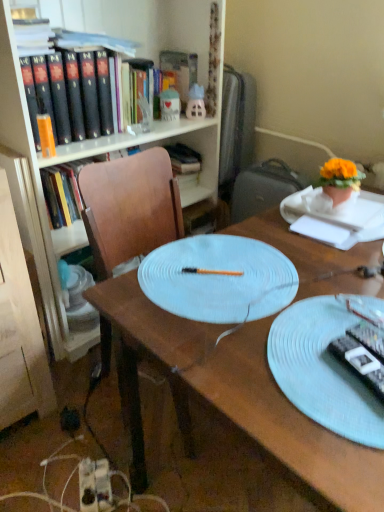
Question: Is matte wood bookcase at upper left oriented away from matte pink plastic toy at upper center, which is counted as the first toy, starting from the right?

Choices:
 (A) yes
 (B) no

Answer: (B)

Question: From a real-world perspective, does matte wood bookcase at upper left sit lower than matte pink plastic toy at upper center, the second toy positioned from the left?

Choices:
 (A) yes
 (B) no

Answer: (A)

Question: Does matte wood bookcase at upper left come behind matte pink plastic toy at upper center, the second toy positioned from the left?

Choices:
 (A) no
 (B) yes

Answer: (A)

Question: Does matte wood bookcase at upper left have a greater width compared to matte pink plastic toy at upper center, the second toy positioned from the left?

Choices:
 (A) yes
 (B) no

Answer: (A)

Question: From the image's perspective, is matte wood bookcase at upper left on matte pink plastic toy at upper center, which is counted as the first toy, starting from the right?

Choices:
 (A) yes
 (B) no

Answer: (B)

Question: Is light blue textured plate at center situated inside wooden desk at center or outside?

Choices:
 (A) outside
 (B) inside

Answer: (B)

Question: From their relative heights in the image, would you say light blue textured plate at center is taller or shorter than wooden desk at center?

Choices:
 (A) short
 (B) tall

Answer: (A)

Question: Is point (337, 361) positioned closer to the camera than point (281, 418)?

Choices:
 (A) farther
 (B) closer

Answer: (A)

Question: From the image's perspective, relative to wooden desk at center, is light blue textured plate at center above or below?

Choices:
 (A) below
 (B) above

Answer: (B)

Question: Which is correct: black plastic remote control at right, the first remote control from the right, is inside matte pink plastic toy at upper center, which is counted as the first toy, starting from the right, or outside of it?

Choices:
 (A) inside
 (B) outside

Answer: (B)

Question: Visually, is black plastic remote control at right, arranged as the 2th remote control when viewed from the left, positioned to the left or to the right of matte pink plastic toy at upper center, which is counted as the first toy, starting from the right?

Choices:
 (A) left
 (B) right

Answer: (B)

Question: Looking at the image, does black plastic remote control at right, the first remote control from the right, seem bigger or smaller compared to matte pink plastic toy at upper center, the second toy positioned from the left?

Choices:
 (A) big
 (B) small

Answer: (B)

Question: From a real-world perspective, relative to matte pink plastic toy at upper center, which is counted as the first toy, starting from the right, is black plastic remote control at right, the first remote control from the right, vertically above or below?

Choices:
 (A) below
 (B) above

Answer: (A)

Question: From the image's perspective, is matte wood bookcase at upper left positioned above or below black plastic remote control at lower right, which appears as the second remote control when viewed from the right?

Choices:
 (A) above
 (B) below

Answer: (A)

Question: Based on their positions, is matte wood bookcase at upper left located to the left or right of black plastic remote control at lower right, the 1th remote control positioned from the left?

Choices:
 (A) left
 (B) right

Answer: (A)